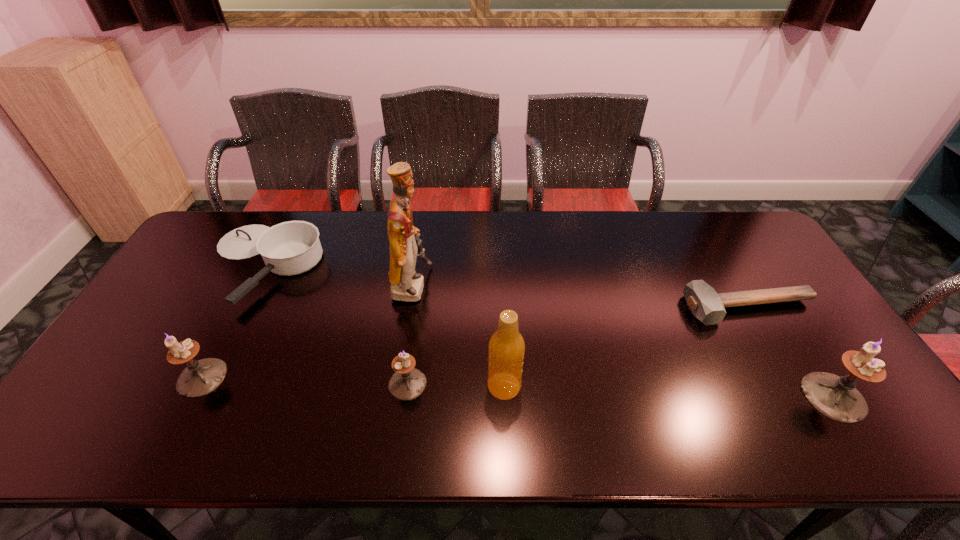
If we want them evenly spaced by inserting an extra candle_holder among them, please locate a free spot for this new candle_holder. Please provide its 2D coordinates. Your answer should be formatted as a tuple, i.e. [(x, y)], where the tuple contains the x and y coordinates of a point satisfying the conditions above.

[(618, 390)]